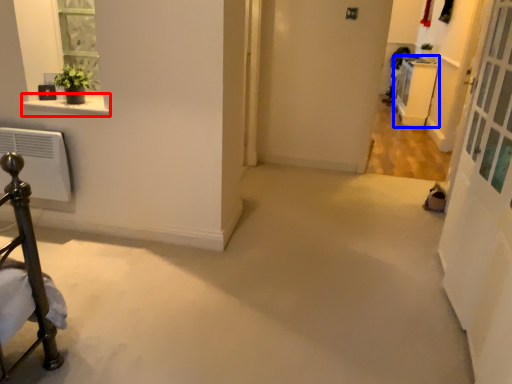
Question: Which object is further to the camera taking this photo, window sill (highlighted by a red box) or furniture (highlighted by a blue box)?

Choices:
 (A) window sill
 (B) furniture

Answer: (B)